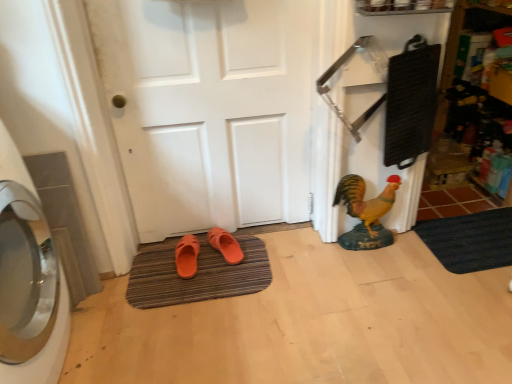
Locate an element on the screen. vacant space situated on the left part of orange matte slippers at center, arranged as the 2th footwear when viewed from the left is located at coordinates (172, 260).